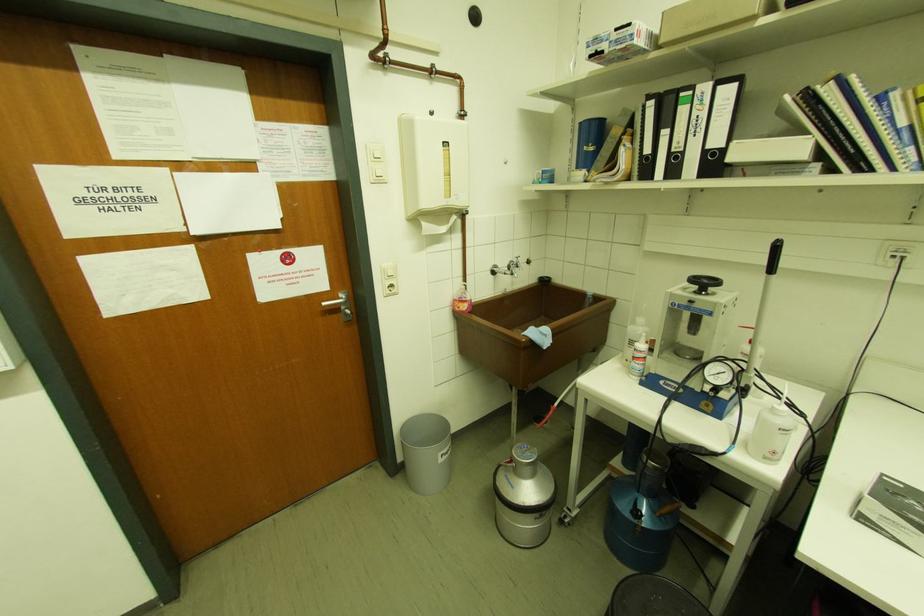
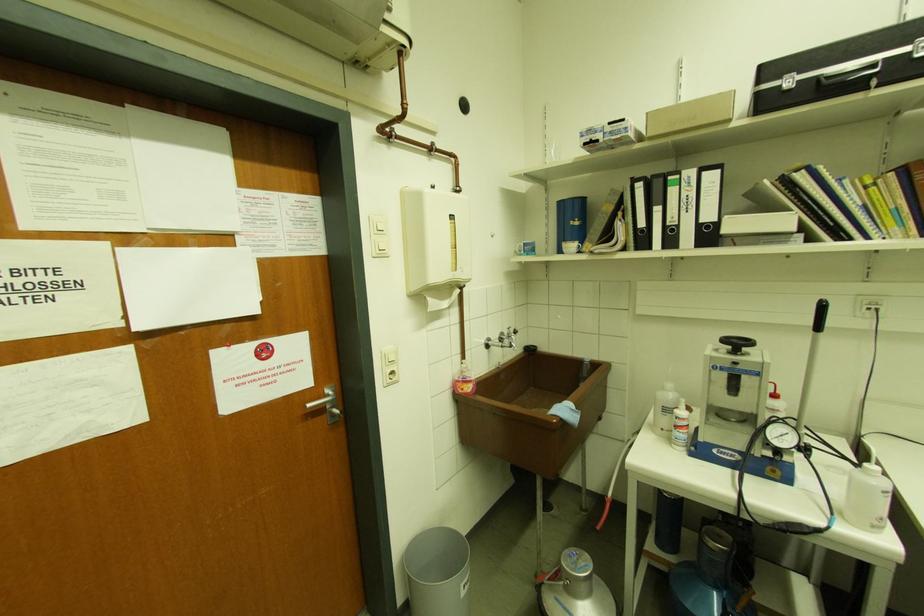
Locate, in the second image, the point that corresponds to pixel 326 305 in the first image.

(312, 407)